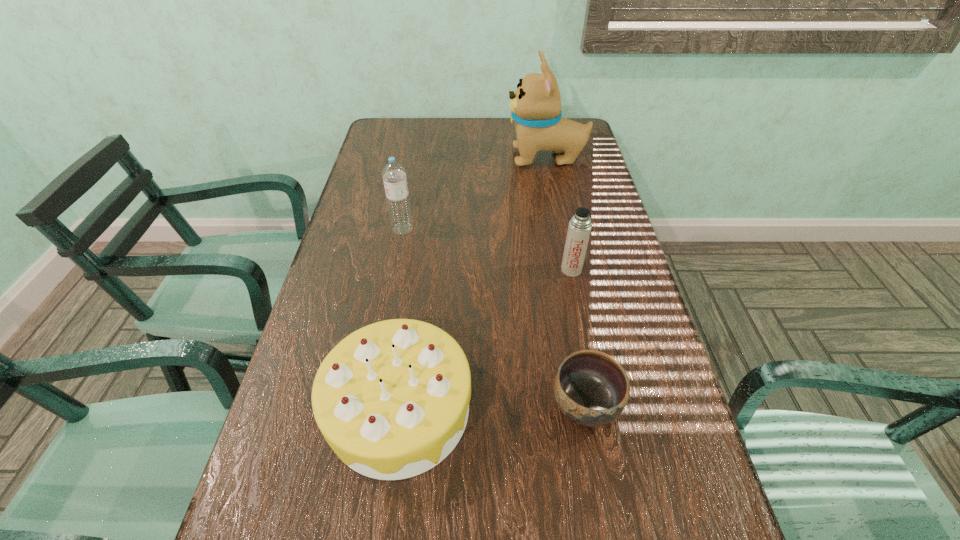
The image size is (960, 540). Find the location of `free space between the bowl and the tallest object`. free space between the bowl and the tallest object is located at coordinates (565, 281).

Locate an element on the screen. This screenshot has height=540, width=960. free area in between the farthest object and the bowl is located at coordinates (565, 281).

This screenshot has width=960, height=540. What are the coordinates of `free space between the tallest object and the thermos bottle` in the screenshot? It's located at (559, 214).

Find the location of a particular element. The image size is (960, 540). empty space that is in between the water bottle and the third farthest object is located at coordinates (487, 249).

I want to click on the fourth closest object relative to the birthday cake, so click(x=535, y=107).

Identify which object is the second closest to the thermos bottle. Please provide its 2D coordinates. Your answer should be formatted as a tuple, i.e. [(x, y)], where the tuple contains the x and y coordinates of a point satisfying the conditions above.

[(391, 399)]

Find the location of a particular element. free spot that satisfies the following two spatial constraints: 1. on the face of the tallest object; 2. on the left side of the thermos bottle is located at coordinates (568, 269).

Where is `vacant space that satisfies the following two spatial constraints: 1. on the face of the thermos bottle; 2. on the left side of the farthest object`? The width and height of the screenshot is (960, 540). vacant space that satisfies the following two spatial constraints: 1. on the face of the thermos bottle; 2. on the left side of the farthest object is located at coordinates (568, 269).